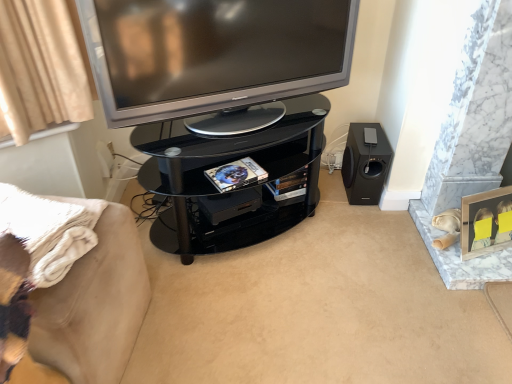
I want to click on vacant area situated below silver metallic television at upper center (from a real-world perspective), so click(x=238, y=117).